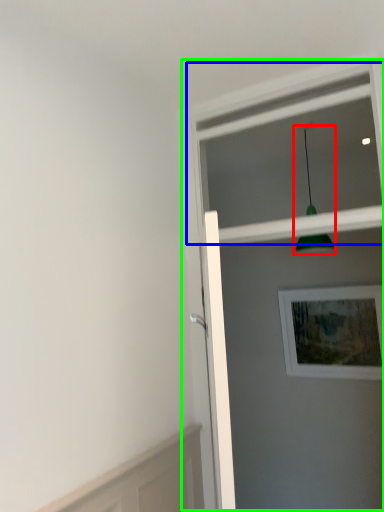
Question: Which object is the farthest from light fixture (highlighted by a red box)? Choose among these: window frame (highlighted by a blue box) or screen door (highlighted by a green box).

Choices:
 (A) window frame
 (B) screen door

Answer: (B)